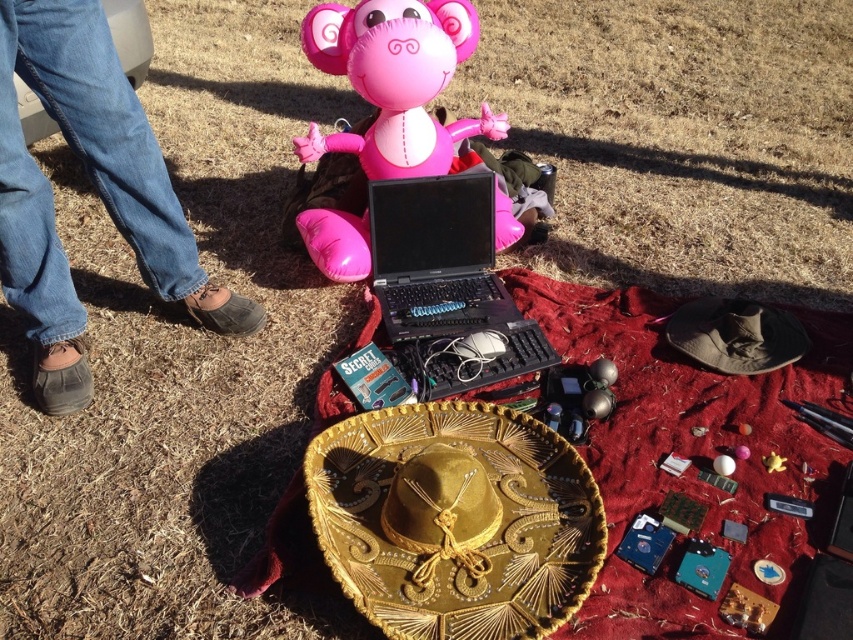
Question: Which point is closer to the camera taking this photo?

Choices:
 (A) (483, 209)
 (B) (99, 177)

Answer: (B)

Question: Estimate the real-world distances between objects in this image. Which object is farther from the pink inflatable monkey at center?

Choices:
 (A) brown suede shoes at lower left
 (B) black plastic laptop at center

Answer: (A)

Question: Which point appears closest to the camera in this image?

Choices:
 (A) (392, 211)
 (B) (334, 10)
 (C) (132, 211)

Answer: (C)

Question: Does brown suede shoes at lower left appear under black plastic laptop at center?

Choices:
 (A) yes
 (B) no

Answer: (B)

Question: Can you confirm if brown suede shoes at lower left is positioned above black plastic laptop at center?

Choices:
 (A) no
 (B) yes

Answer: (B)

Question: Can you confirm if brown suede shoes at lower left is positioned below black plastic laptop at center?

Choices:
 (A) no
 (B) yes

Answer: (A)